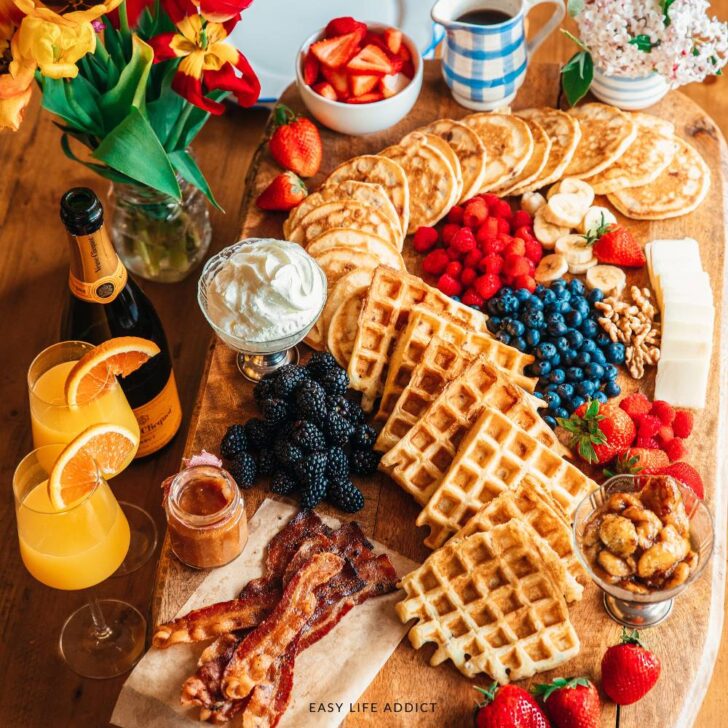
The height and width of the screenshot is (728, 728). Identify the location of wine glass. (84, 563), (52, 422), (146, 539), (129, 630).